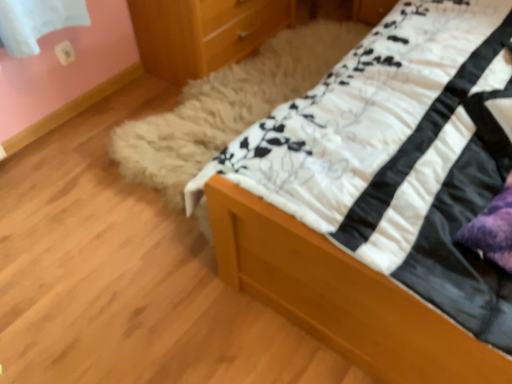
Question: Can you confirm if wooden chest of drawers at upper center is shorter than white soft quilt at upper right?

Choices:
 (A) yes
 (B) no

Answer: (B)

Question: Would you say white soft quilt at upper right is part of wooden chest of drawers at upper center's contents?

Choices:
 (A) no
 (B) yes

Answer: (A)

Question: Considering the relative positions of wooden chest of drawers at upper center and white soft quilt at upper right in the image provided, is wooden chest of drawers at upper center to the left of white soft quilt at upper right from the viewer's perspective?

Choices:
 (A) yes
 (B) no

Answer: (A)

Question: Does wooden chest of drawers at upper center have a greater width compared to white soft quilt at upper right?

Choices:
 (A) no
 (B) yes

Answer: (A)

Question: From a real-world perspective, is wooden chest of drawers at upper center beneath white soft quilt at upper right?

Choices:
 (A) yes
 (B) no

Answer: (B)

Question: Can you confirm if wooden chest of drawers at upper center is smaller than white soft quilt at upper right?

Choices:
 (A) no
 (B) yes

Answer: (B)

Question: From the image's perspective, is white soft quilt at upper right on wooden chest of drawers at upper center?

Choices:
 (A) no
 (B) yes

Answer: (A)

Question: From a real-world perspective, is white soft quilt at upper right located beneath wooden chest of drawers at upper center?

Choices:
 (A) no
 (B) yes

Answer: (B)

Question: Does white soft quilt at upper right turn towards wooden chest of drawers at upper center?

Choices:
 (A) no
 (B) yes

Answer: (A)

Question: From the image's perspective, does white soft quilt at upper right appear lower than wooden chest of drawers at upper center?

Choices:
 (A) no
 (B) yes

Answer: (B)

Question: Can you confirm if white soft quilt at upper right is wider than wooden chest of drawers at upper center?

Choices:
 (A) no
 (B) yes

Answer: (B)

Question: Considering the relative sizes of white soft quilt at upper right and wooden chest of drawers at upper center in the image provided, is white soft quilt at upper right taller than wooden chest of drawers at upper center?

Choices:
 (A) yes
 (B) no

Answer: (B)

Question: Considering their positions, is white soft quilt at upper right located in front of or behind wooden chest of drawers at upper center?

Choices:
 (A) behind
 (B) front

Answer: (B)